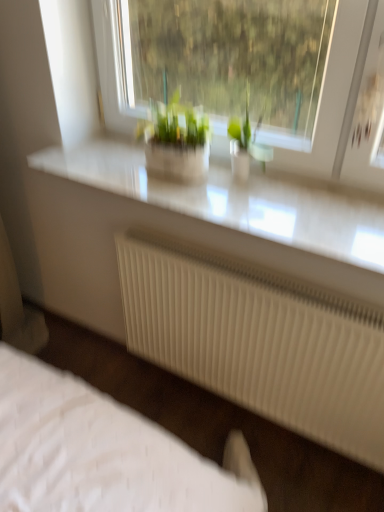
Where is `vacant area that is in front of green glass vase at center, the 2th houseplant positioned from the left`? vacant area that is in front of green glass vase at center, the 2th houseplant positioned from the left is located at coordinates (262, 202).